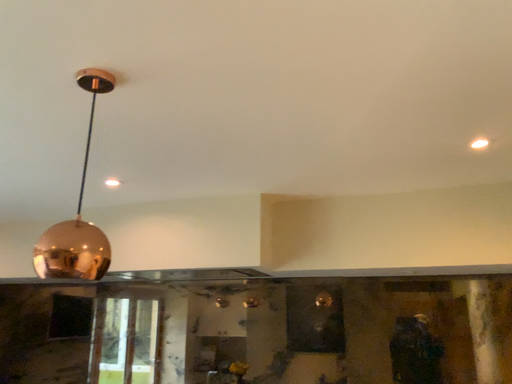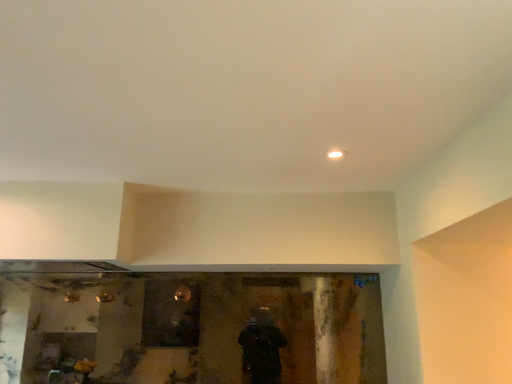
Question: How did the camera likely rotate when shooting the video?

Choices:
 (A) rotated left
 (B) rotated right

Answer: (B)